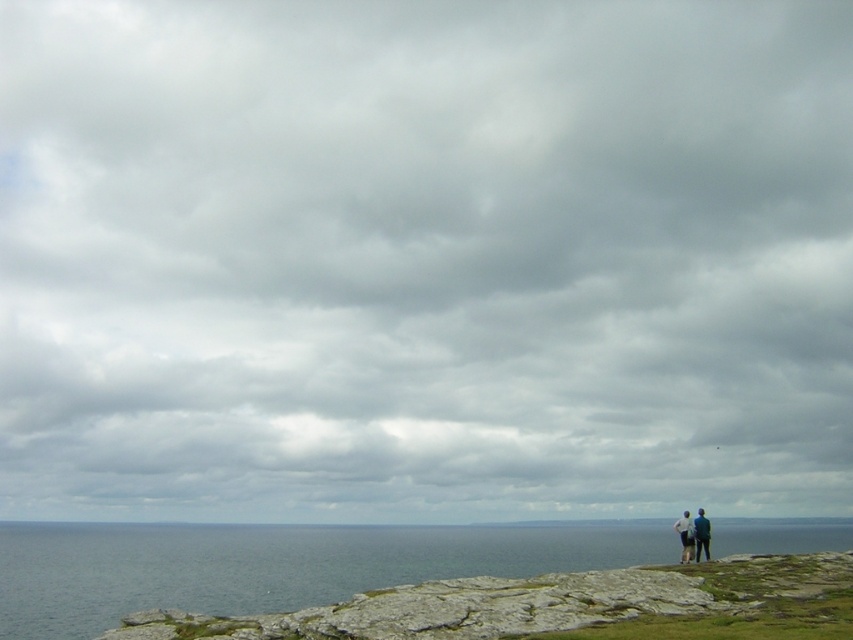
You are a photographer trying to capture the blue water at lower left and the white cotton shirt at right in the same frame. Based on their positions, which object should you adjust your camera to focus on first to ensure both are in the shot?

The blue water at lower left is to the right of the white cotton shirt at right, so you should focus on the white cotton shirt at right first to ensure both are within the frame.

You are a photographer positioned at the center of the rocky outcrop. You want to capture a photo of both the blue denim jacket at lower right and the white cotton shirt at right in the same frame. Which direction should you move to ensure both are visible?

To include both the blue denim jacket at lower right and the white cotton shirt at right in the frame, move to the left. Since the blue denim jacket at lower right is to the left of the white cotton shirt at right, moving left will widen your angle to capture both subjects.